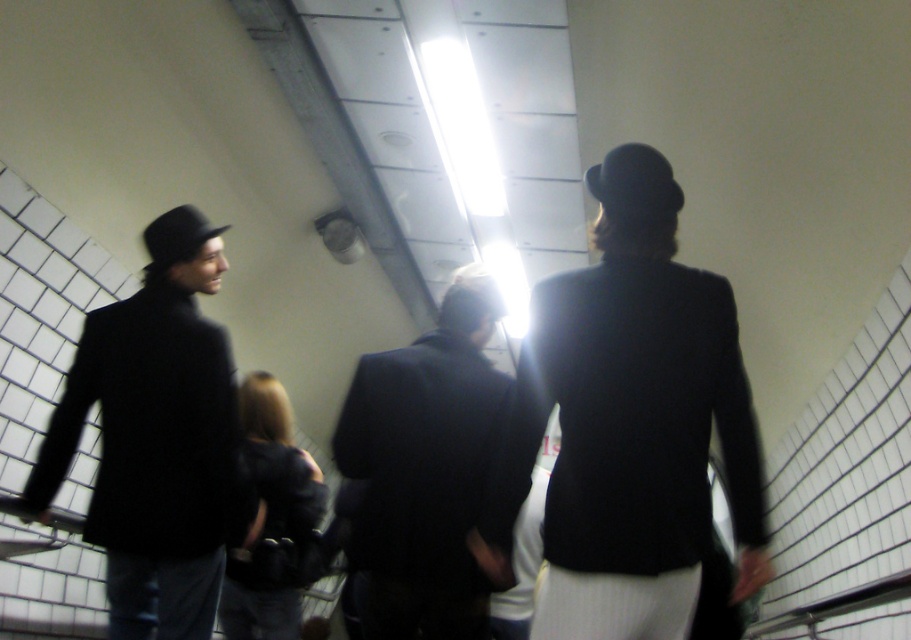
Consider the image. Can you confirm if matte black coat at left is thinner than black leather jacket at center?

In fact, matte black coat at left might be wider than black leather jacket at center.

In the scene shown: Is the position of matte black coat at left less distant than that of black leather jacket at center?

That is True.

Who is more forward, (179, 282) or (267, 604)?

Point (179, 282)

Where is `matte black coat at left`? Image resolution: width=911 pixels, height=640 pixels. matte black coat at left is located at coordinates (159, 440).

Who is positioned more to the left, matte black blazer at center or matte black coat at left?

Positioned to the left is matte black coat at left.

Does matte black blazer at center have a greater width compared to matte black coat at left?

Incorrect, matte black blazer at center's width does not surpass matte black coat at left's.

Measure the distance between point (582, 433) and camera.

1.67 meters

Image resolution: width=911 pixels, height=640 pixels. Identify the location of matte black blazer at center. (635, 419).

Based on the photo, can you confirm if matte black coat at left is smaller than dark suit at center?

No.

Who is lower down, matte black coat at left or dark suit at center?

dark suit at center is below.

Is point (144, 529) positioned after point (456, 502)?

Yes, point (144, 529) is behind point (456, 502).

I want to click on matte black coat at left, so click(x=159, y=440).